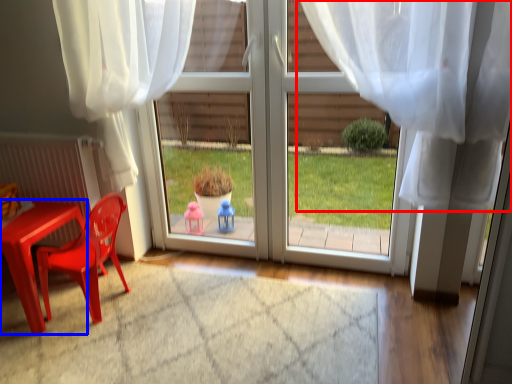
Question: Which object is closer to the camera taking this photo, curtain (highlighted by a red box) or table (highlighted by a blue box)?

Choices:
 (A) curtain
 (B) table

Answer: (A)